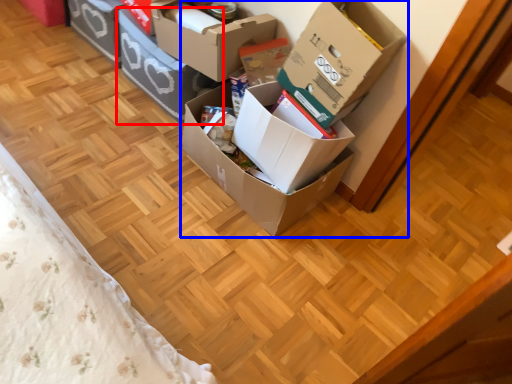
Question: Which object is closer to the camera taking this photo, box (highlighted by a red box) or box (highlighted by a blue box)?

Choices:
 (A) box
 (B) box

Answer: (B)